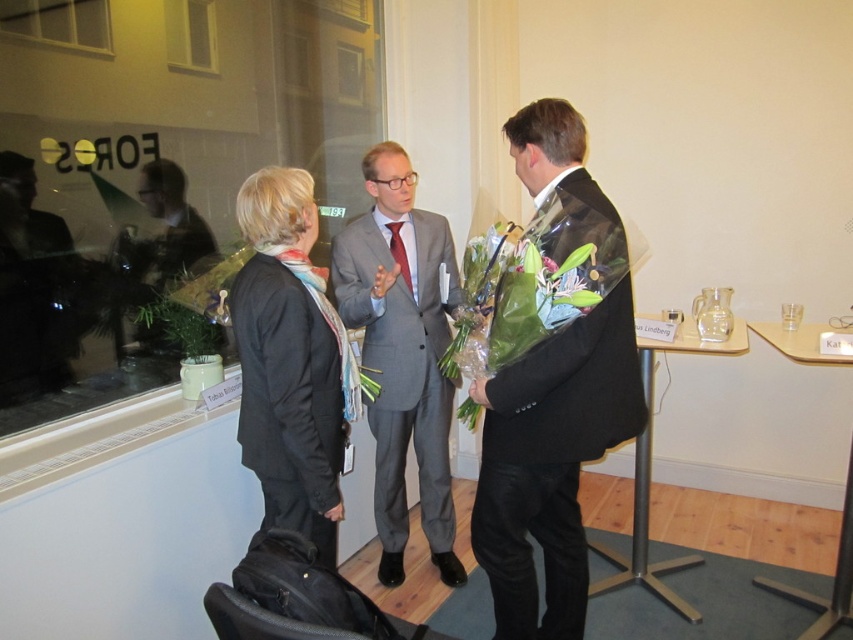
Question: Which of the following is the closest to the observer?

Choices:
 (A) green leafy bouquet at center
 (B) clear glass window at upper left
 (C) gray suit at center

Answer: (A)

Question: Which point is closer to the camera?

Choices:
 (A) green leafy bouquet at center
 (B) gray suit at center
 (C) black matte suit at right

Answer: (A)

Question: Does transparent glass window at upper left appear on the right side of green leafy bouquet at center?

Choices:
 (A) no
 (B) yes

Answer: (A)

Question: Does black woolen suit at center have a smaller size compared to clear glass window at upper left?

Choices:
 (A) no
 (B) yes

Answer: (A)

Question: From the image, what is the correct spatial relationship of black matte suit at right in relation to clear glass window at upper left?

Choices:
 (A) left
 (B) right

Answer: (B)

Question: Which object is positioned closest to the transparent glass window at upper left?

Choices:
 (A) black matte suit at right
 (B) black woolen suit at center
 (C) clear glass window at upper left

Answer: (C)